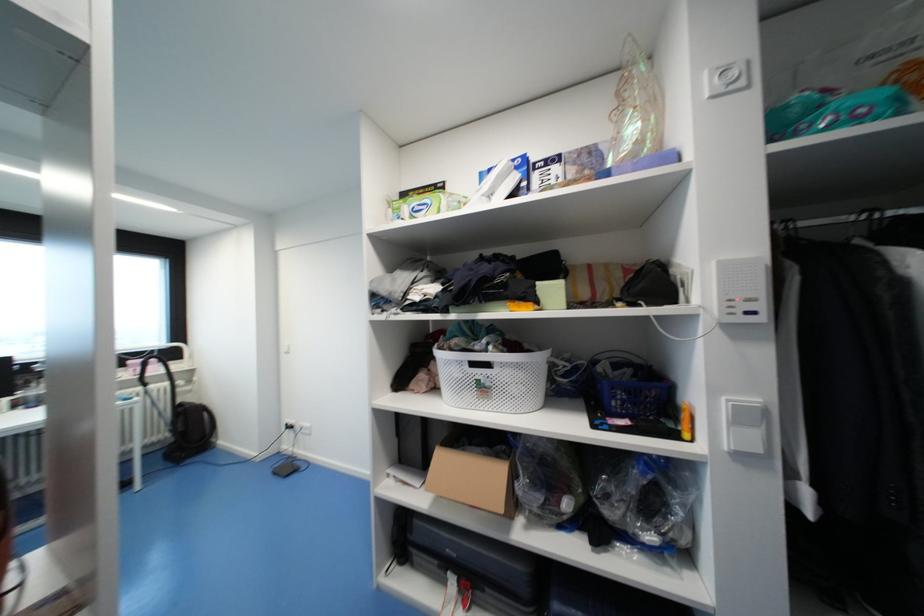
Where is `cardboard box`? cardboard box is located at coordinates (472, 471).